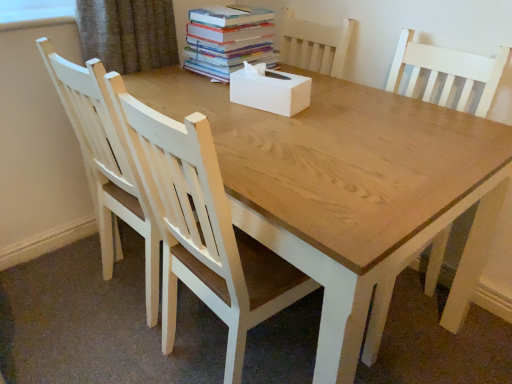
Question: Is white matte tissue box at center not within white wood chair at left, which ranks as the second chair in right-to-left order?

Choices:
 (A) yes
 (B) no

Answer: (A)

Question: Considering the relative sizes of white matte tissue box at center and white wood chair at left, which ranks as the second chair in right-to-left order, in the image provided, is white matte tissue box at center wider than white wood chair at left, which ranks as the second chair in right-to-left order,?

Choices:
 (A) no
 (B) yes

Answer: (A)

Question: Can you confirm if white matte tissue box at center is positioned to the left of white wood chair at left, which is the 1th chair from left to right?

Choices:
 (A) no
 (B) yes

Answer: (A)

Question: Is white matte tissue box at center to the right of white wood chair at left, which ranks as the second chair in right-to-left order, from the viewer's perspective?

Choices:
 (A) no
 (B) yes

Answer: (B)

Question: Are white matte tissue box at center and white wood chair at left, which ranks as the second chair in right-to-left order, making contact?

Choices:
 (A) yes
 (B) no

Answer: (B)

Question: Does white matte tissue box at center have a greater height compared to white wood chair at left, which is the 1th chair from left to right?

Choices:
 (A) no
 (B) yes

Answer: (A)

Question: Can you confirm if white wood chair at left, which is the 1th chair from left to right, is thinner than white wood chair at center, the second chair positioned from the left?

Choices:
 (A) yes
 (B) no

Answer: (B)

Question: Is white wood chair at left, which ranks as the second chair in right-to-left order, beside white wood chair at center, which is the first chair from right to left?

Choices:
 (A) yes
 (B) no

Answer: (B)

Question: Does white wood chair at left, which ranks as the second chair in right-to-left order, appear on the left side of white wood chair at center, which is the first chair from right to left?

Choices:
 (A) no
 (B) yes

Answer: (B)

Question: Can you confirm if white wood chair at left, which ranks as the second chair in right-to-left order, is taller than white wood chair at center, which is the first chair from right to left?

Choices:
 (A) yes
 (B) no

Answer: (A)

Question: Can you confirm if white wood chair at left, which is the 1th chair from left to right, is positioned to the right of white wood chair at center, which is the first chair from right to left?

Choices:
 (A) no
 (B) yes

Answer: (A)

Question: Can you confirm if white wood chair at left, which ranks as the second chair in right-to-left order, is shorter than white wood chair at center, which is the first chair from right to left?

Choices:
 (A) no
 (B) yes

Answer: (A)

Question: Does white wood chair at left, which ranks as the second chair in right-to-left order, lie in front of hardcover books at upper center?

Choices:
 (A) no
 (B) yes

Answer: (B)